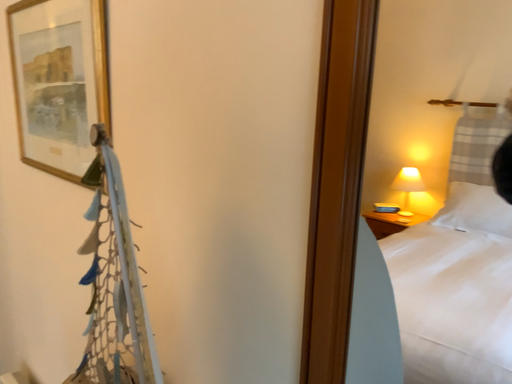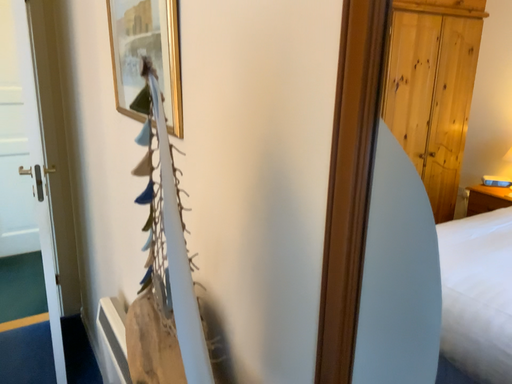
Question: How did the camera likely rotate when shooting the video?

Choices:
 (A) rotated right
 (B) rotated left

Answer: (B)